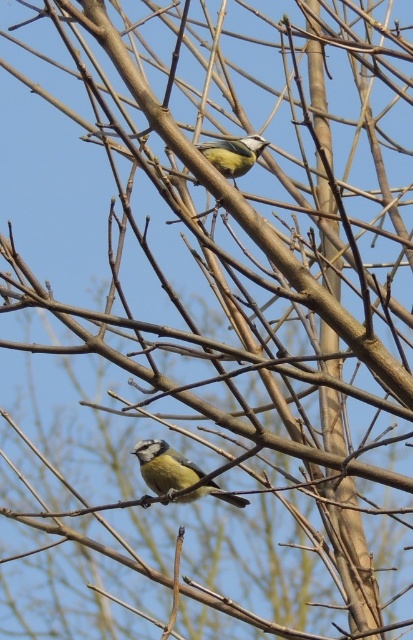
Question: Is blue-green feathers at lower center wider than blue matte bird at upper center?

Choices:
 (A) yes
 (B) no

Answer: (A)

Question: Considering the relative positions of blue-green feathers at lower center and blue matte bird at upper center in the image provided, where is blue-green feathers at lower center located with respect to blue matte bird at upper center?

Choices:
 (A) below
 (B) above

Answer: (A)

Question: Is the position of blue-green feathers at lower center less distant than that of blue matte bird at upper center?

Choices:
 (A) no
 (B) yes

Answer: (A)

Question: Which point is closer to the camera?

Choices:
 (A) blue-green feathers at lower center
 (B) blue matte bird at upper center

Answer: (B)

Question: Which point is farther to the camera?

Choices:
 (A) (189, 476)
 (B) (242, 160)

Answer: (A)